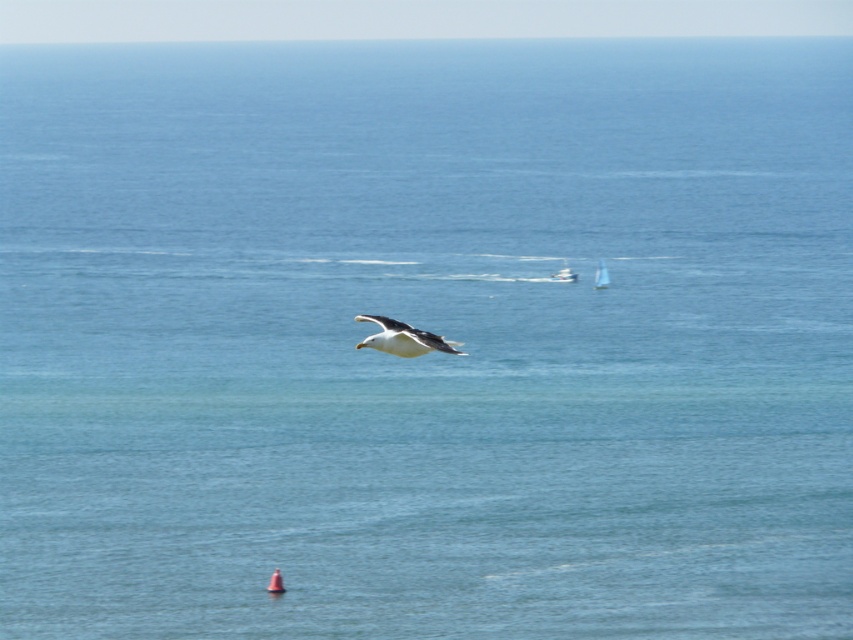
Based on the photo, does white plastic sailboat at center lie in front of white sailboat at center?

No, white plastic sailboat at center is further to the viewer.

Who is more distant from viewer, (567,282) or (604,280)?

Point (567,282)

Find the location of a particular element. white plastic sailboat at center is located at coordinates (564, 275).

Can you confirm if white plastic sailboat at center is positioned below orange buoy at center?

Incorrect, white plastic sailboat at center is not positioned below orange buoy at center.

Can you confirm if white plastic sailboat at center is smaller than orange buoy at center?

Incorrect, white plastic sailboat at center is not smaller in size than orange buoy at center.

Find the location of a particular element. white plastic sailboat at center is located at coordinates (564, 275).

You are a GUI agent. You are given a task and a screenshot of the screen. Output one action in this format:
    pyautogui.click(x=<x>, y=<y>)
    Task: Click on the white plastic sailboat at center
    The width and height of the screenshot is (853, 640).
    Given the screenshot: What is the action you would take?
    pyautogui.click(x=564, y=275)

Does white matte seagull at center have a lesser height compared to orange buoy at center?

No, white matte seagull at center is not shorter than orange buoy at center.

Does white matte seagull at center appear on the left side of orange buoy at center?

Incorrect, white matte seagull at center is not on the left side of orange buoy at center.

The height and width of the screenshot is (640, 853). What do you see at coordinates (403, 339) in the screenshot?
I see `white matte seagull at center` at bounding box center [403, 339].

Image resolution: width=853 pixels, height=640 pixels. In order to click on white matte seagull at center in this screenshot , I will do `click(403, 339)`.